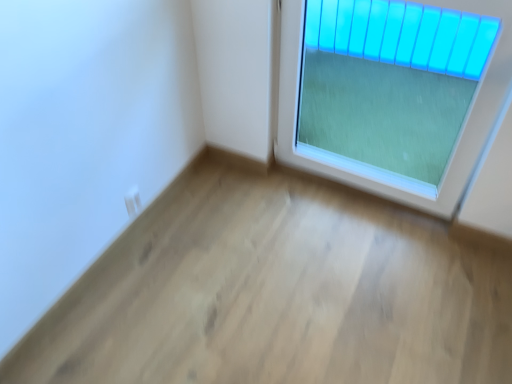
At what (x,y) coordinates should I click in order to perform the action: click on transparent glass window at upper right. Please return your answer as a coordinate pair (x, y). Looking at the image, I should click on pos(400,71).

The height and width of the screenshot is (384, 512). What do you see at coordinates (400, 71) in the screenshot? I see `transparent glass window at upper right` at bounding box center [400, 71].

Measure the distance between transparent glass window at upper right and camera.

transparent glass window at upper right and camera are 1.26 meters apart from each other.

You are a GUI agent. You are given a task and a screenshot of the screen. Output one action in this format:
    pyautogui.click(x=<x>, y=<y>)
    Task: Click on the transparent glass window at upper right
    This screenshot has width=512, height=384.
    Given the screenshot: What is the action you would take?
    pyautogui.click(x=400, y=71)